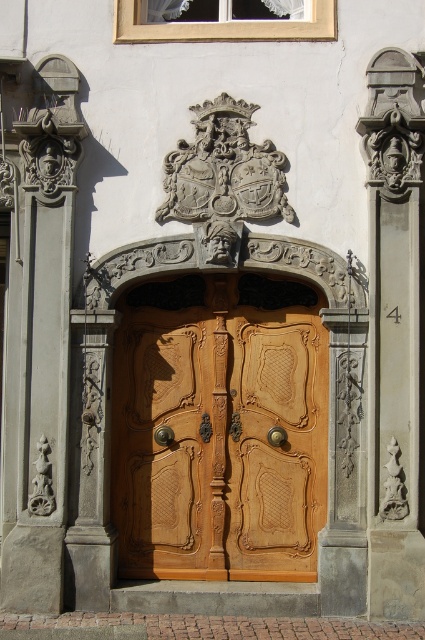
You are an architect designing a new building and want to ensure that the wooden carved door at center aligns properly with the stone carving at right in terms of height. Based on the image, which object should be adjusted to match the other in height?

The wooden carved door at center is shorter than the stone carving at right, so the door should be adjusted to match the height of the stone carving at right.

You are an architect examining the ornate wooden door and the stone archway above it. Based on their positions, can you determine if the wooden carved door at center is positioned below the stone archway?

The wooden carved door at center is located at point (220, 428), which places it below the stone archway above the door. Therefore, yes, the wooden carved door at center is positioned below the stone archway.